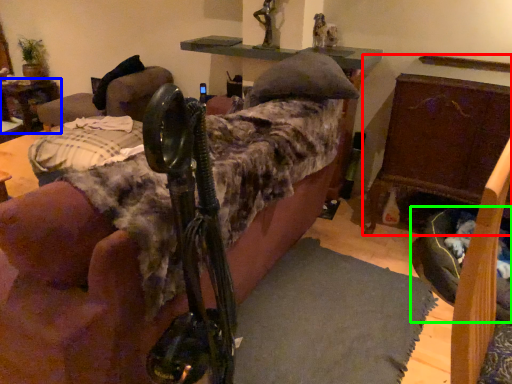
Question: Considering the real-world distances, which object is farthest from furniture (highlighted by a red box)? table (highlighted by a blue box) or dog bed (highlighted by a green box)?

Choices:
 (A) table
 (B) dog bed

Answer: (A)